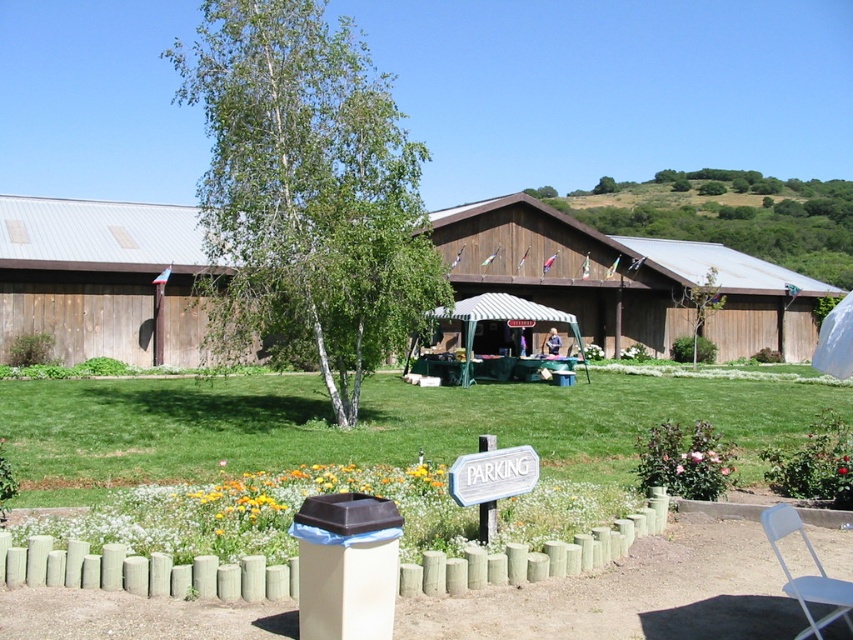
Question: Which point appears closest to the camera in this image?

Choices:
 (A) click(x=146, y=595)
 (B) click(x=332, y=454)
 (C) click(x=167, y=225)

Answer: (A)

Question: In this image, where is green grass at lower center located relative to green wooden fence at lower center?

Choices:
 (A) right
 (B) left

Answer: (B)

Question: Is the position of green grass at lower center less distant than that of white plastic chair at lower right?

Choices:
 (A) yes
 (B) no

Answer: (B)

Question: Based on their relative distances, which object is nearer to the green wooden fence at lower center?

Choices:
 (A) green grass at lower center
 (B) white plastic chair at lower right
 (C) brown wooden barn at center
 (D) green leafy tree at upper center

Answer: (B)

Question: Which point is closer to the camera taking this photo?

Choices:
 (A) (746, 218)
 (B) (437, 216)

Answer: (B)

Question: Can you confirm if green wooden fence at lower center is positioned to the right of white plastic chair at lower right?

Choices:
 (A) no
 (B) yes

Answer: (A)